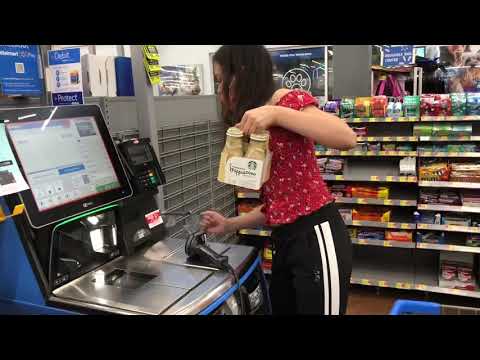
Locate an element on the screen. door with paw on it is located at coordinates (304, 68).